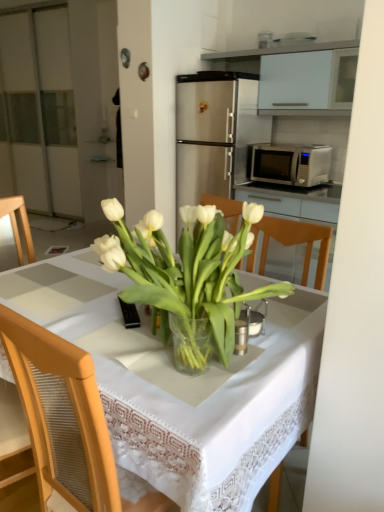
The image size is (384, 512). I want to click on free space to the left of black plastic remote control at center, so click(88, 305).